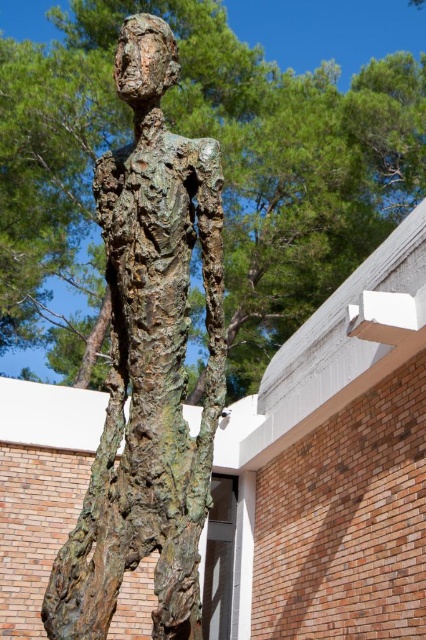
Who is higher up, rusty bronze figure at center or green textured tree at center?

green textured tree at center

Can you confirm if rusty bronze figure at center is wider than green textured tree at center?

No.

Who is more forward, (184, 540) or (60, 300)?

Point (184, 540)

Where is `rusty bronze figure at center`? Image resolution: width=426 pixels, height=640 pixels. rusty bronze figure at center is located at coordinates (149, 362).